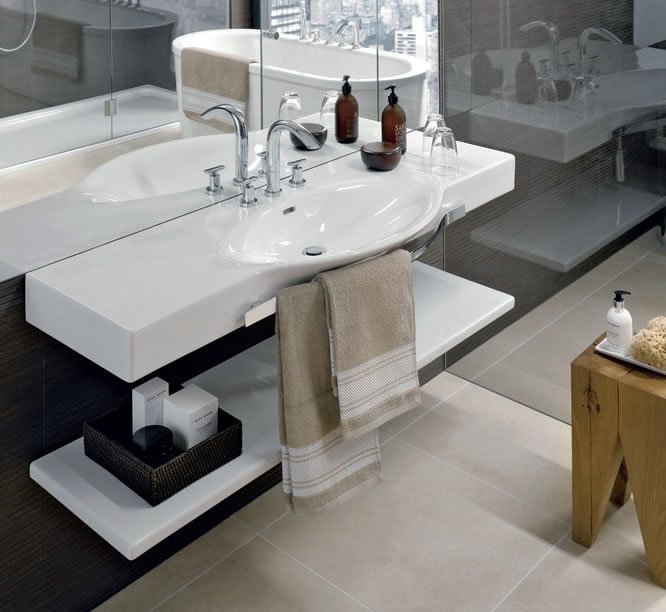
Locate an element on the screen. The width and height of the screenshot is (666, 612). faucet is located at coordinates (274, 185).